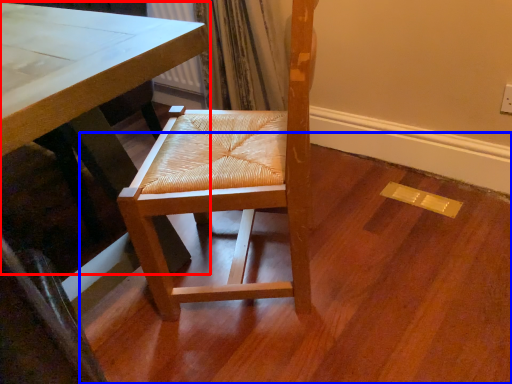
Question: Which of the following is the farthest to the observer, table (highlighted by a red box) or plywood (highlighted by a blue box)?

Choices:
 (A) table
 (B) plywood

Answer: (B)